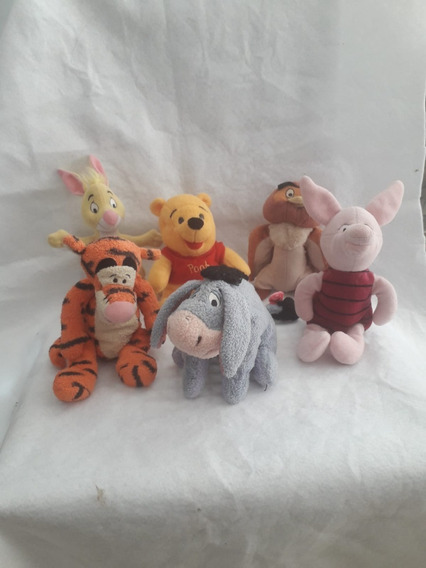
Locate an element on the screen. The width and height of the screenshot is (426, 568). winnie pooh plush dolls is located at coordinates (104, 298), (92, 211), (183, 254), (219, 339), (284, 227), (338, 287).